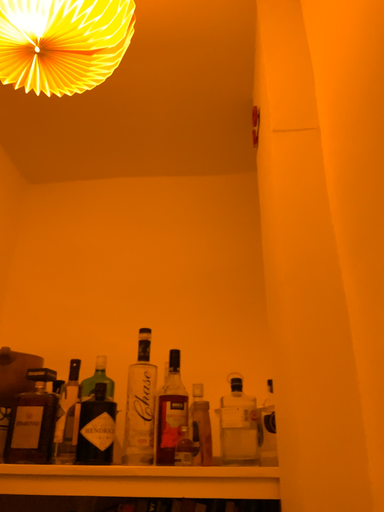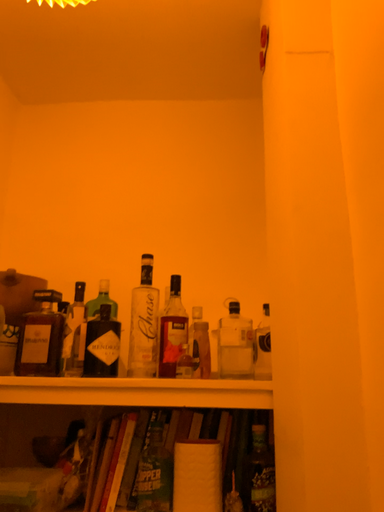
Question: How did the camera likely rotate when shooting the video?

Choices:
 (A) rotated downward
 (B) rotated upward

Answer: (A)